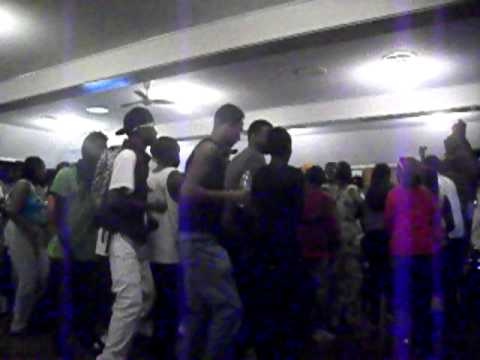
Locate an element on the screen. This screenshot has width=480, height=360. fan is located at coordinates (142, 100).